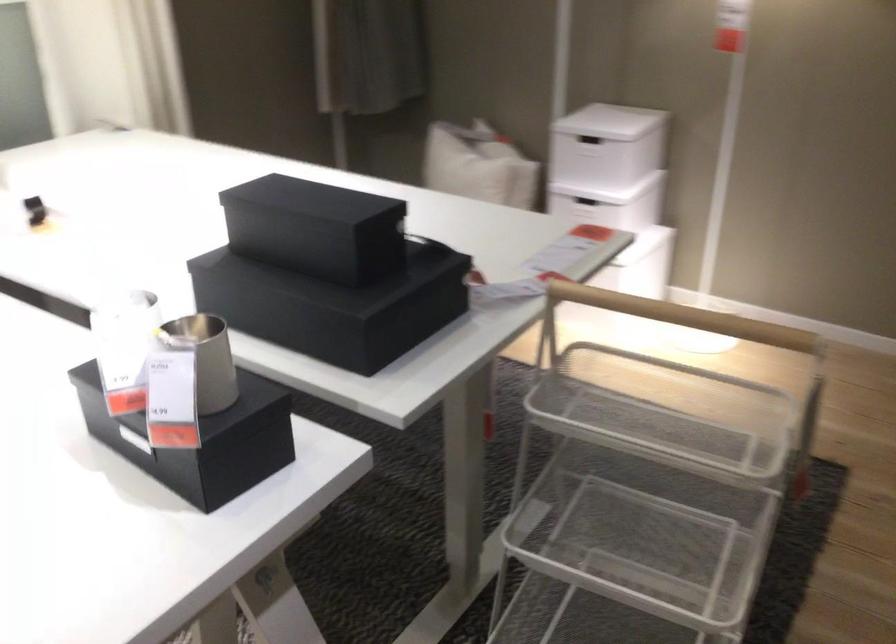
Find the location of a particular element. black box with label is located at coordinates (x=201, y=436).